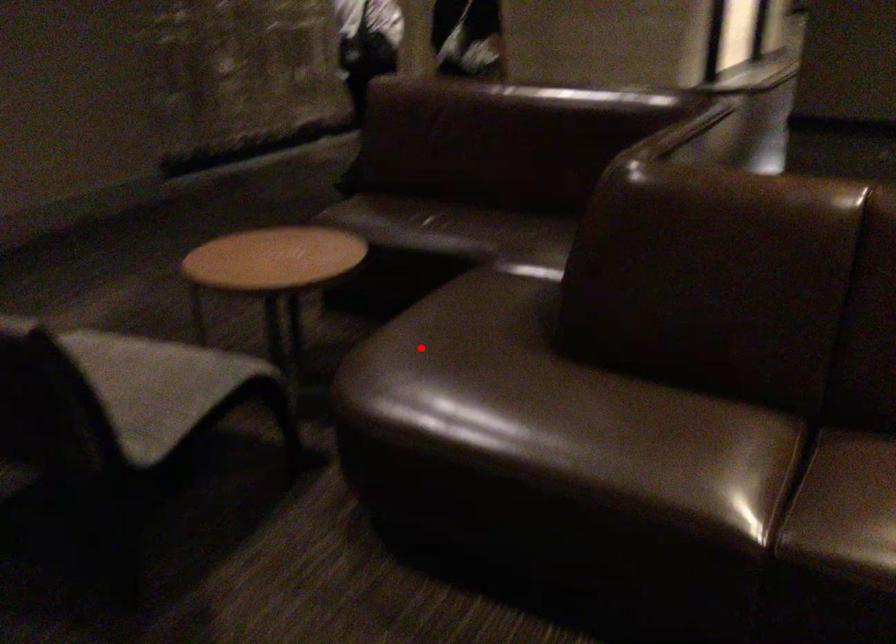
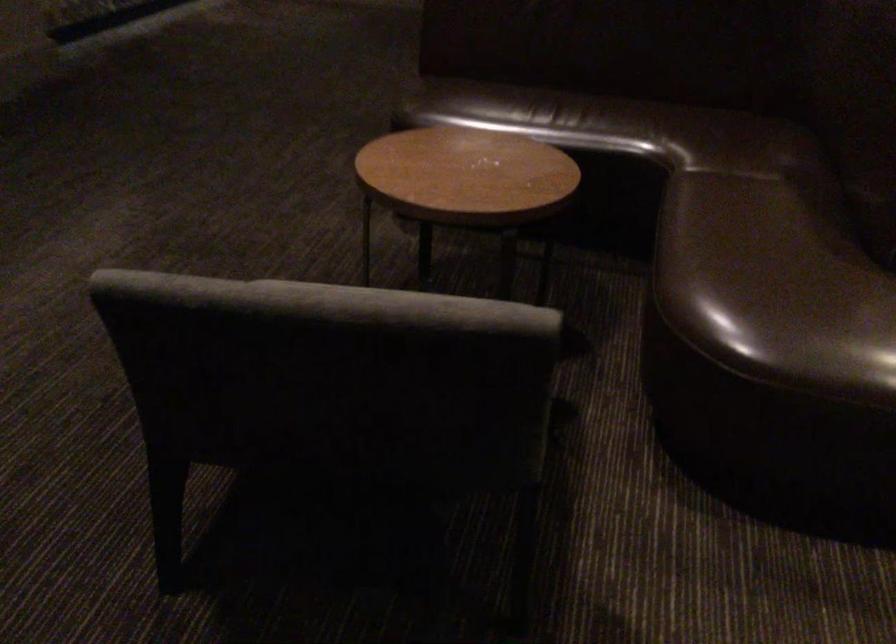
Find the pixel in the second image that matches the highlighted location in the first image.

(772, 276)